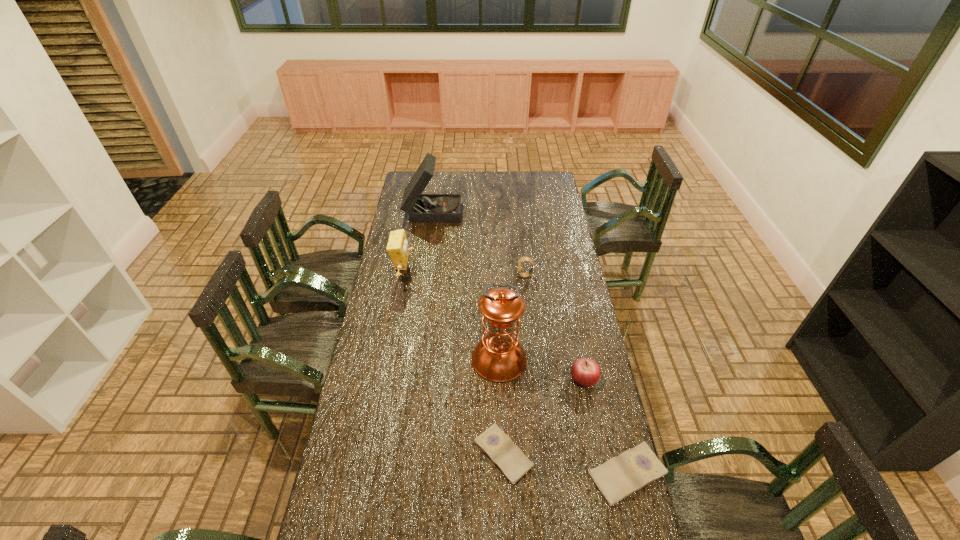
What are the coordinates of `free spot that satisfies the following two spatial constraints: 1. on the front-facing side of the second shortest object; 2. on the left side of the phonograph_record` in the screenshot? It's located at (397, 474).

Find the location of a particular element. blank space that satisfies the following two spatial constraints: 1. on the face of the oil lamp; 2. on the right side of the fifth shortest object is located at coordinates (390, 359).

Locate an element on the screen. vacant space that satisfies the following two spatial constraints: 1. on the front-facing side of the sixth shortest object; 2. on the right side of the shorter diary is located at coordinates (400, 454).

I want to click on vacant point that satisfies the following two spatial constraints: 1. on the front side of the shorter diary; 2. on the left side of the taller diary, so click(504, 474).

Image resolution: width=960 pixels, height=540 pixels. I want to click on free point that satisfies the following two spatial constraints: 1. on the front-facing side of the right diary; 2. on the right side of the farthest object, so click(x=397, y=474).